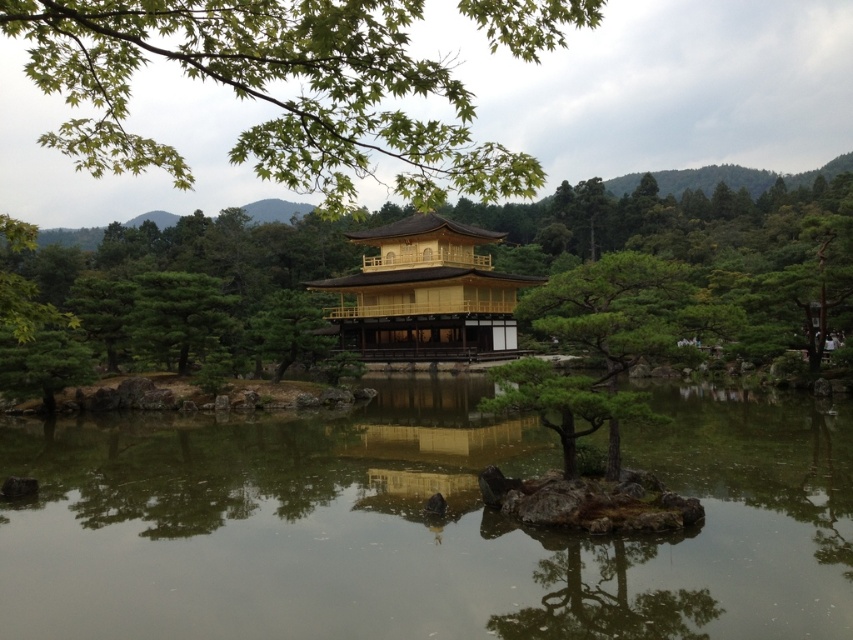
You are a visitor at the Golden Pavilion and want to take a photo that includes both the transparent water at center and the green matte tree at center. Which object should you position closer to the left side of your camera frame to ensure both are visible?

You should position the transparent water at center closer to the left side of your camera frame since it is already on the left side of the green matte tree at center in the scene.

You are standing in front of the Golden Pavilion and notice a green leafy branch at upper center and a green matte tree at center. Which object is closer to you?

The green leafy branch at upper center is positioned over the green matte tree at center, meaning it is closer to you.